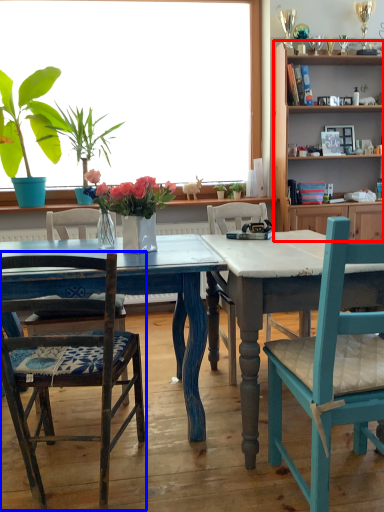
Question: Among these objects, which one is farthest to the camera, cabinetry (highlighted by a red box) or chair (highlighted by a blue box)?

Choices:
 (A) cabinetry
 (B) chair

Answer: (A)